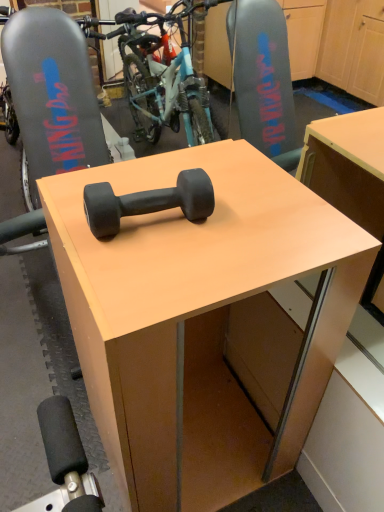
Where is `free space to the back side of black rubber dumbbell at center`? free space to the back side of black rubber dumbbell at center is located at coordinates (157, 170).